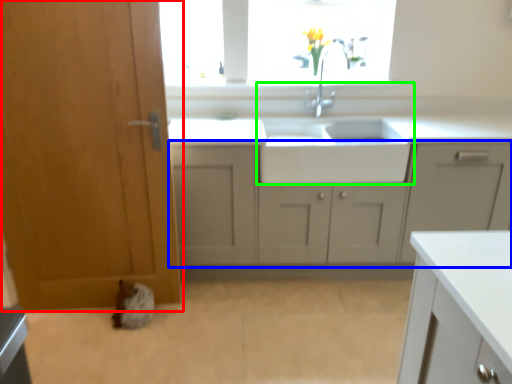
Question: Estimate the real-world distances between objects in this image. Which object is closer to door (highlighted by a red box), cabinetry (highlighted by a blue box) or sink (highlighted by a green box)?

Choices:
 (A) cabinetry
 (B) sink

Answer: (A)